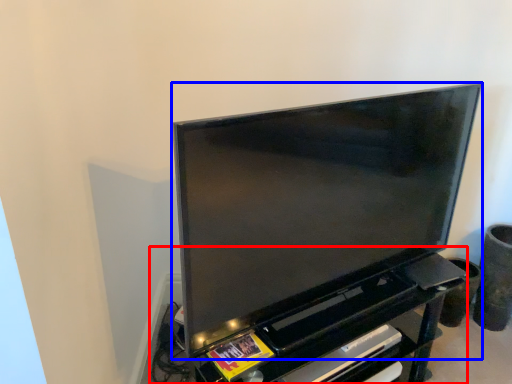
Question: Among these objects, which one is nearest to the camera, entertainment center (highlighted by a red box) or television (highlighted by a blue box)?

Choices:
 (A) entertainment center
 (B) television

Answer: (B)